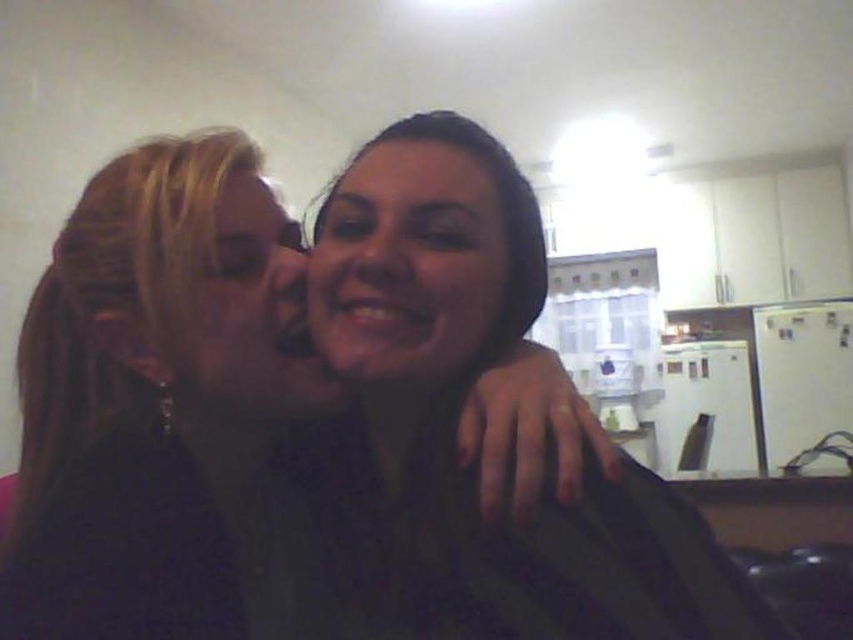
Is matte black shirt at center to the left of matte black face at center from the viewer's perspective?

Correct, you'll find matte black shirt at center to the left of matte black face at center.

Is matte black shirt at center below matte black face at center?

Indeed, matte black shirt at center is positioned under matte black face at center.

Between point (194, 292) and point (219, 340), which one is positioned in front?

Point (194, 292)

This screenshot has width=853, height=640. What are the coordinates of `matte black shirt at center` in the screenshot? It's located at (154, 394).

Who is taller, matte black shirt at center or smooth skin face at center?

With more height is matte black shirt at center.

Does matte black shirt at center come behind smooth skin face at center?

That is False.

Where is `matte black shirt at center`? matte black shirt at center is located at coordinates (154, 394).

Is smooth skin face at center closer to camera compared to matte black face at center?

Yes, smooth skin face at center is closer to the viewer.

Does point (476, 352) come farther from viewer compared to point (233, 371)?

No, it is in front of (233, 371).

Is point (479, 330) more distant than point (259, 220)?

No, it is not.

Image resolution: width=853 pixels, height=640 pixels. I want to click on smooth skin face at center, so click(407, 264).